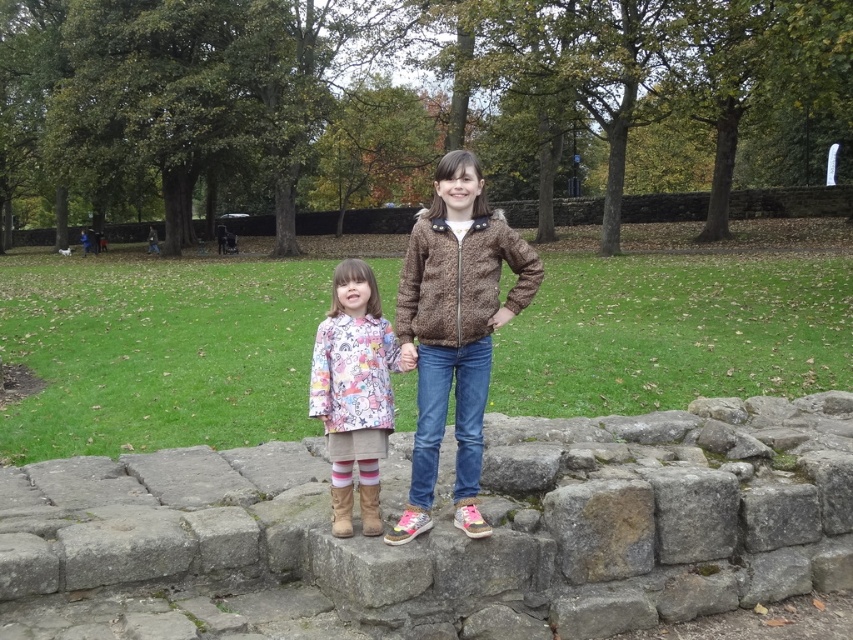
What do you see at coordinates (450, 531) in the screenshot? This screenshot has height=640, width=853. I see `brown stone at center` at bounding box center [450, 531].

Between point (193, 480) and point (428, 246), which one is positioned in front?

Point (428, 246) is more forward.

Does point (700, 560) come in front of point (482, 518)?

No, (700, 560) is behind (482, 518).

You are a GUI agent. You are given a task and a screenshot of the screen. Output one action in this format:
    pyautogui.click(x=<x>, y=<y>)
    Task: Click on the brown stone at center
    
    Given the screenshot: What is the action you would take?
    pyautogui.click(x=450, y=531)

Between brown textured jacket at center and printed fabric coat at center, which one appears on the left side from the viewer's perspective?

printed fabric coat at center is more to the left.

Does point (457, 234) lie in front of point (346, 420)?

No.

From the picture: Who is more forward, (485, 381) or (370, 413)?

Point (370, 413)

At what (x,y) coordinates should I click in order to perform the action: click on brown textured jacket at center. Please return your answer as a coordinate pair (x, y). This screenshot has width=853, height=640. Looking at the image, I should click on (454, 332).

Between brown stone at center and printed fabric coat at center, which one is positioned lower?

Positioned lower is brown stone at center.

Consider the image. Which of these two, brown stone at center or printed fabric coat at center, stands shorter?

brown stone at center

Is point (308, 538) positioned after point (376, 465)?

Yes, point (308, 538) is behind point (376, 465).

Locate an element on the screen. brown stone at center is located at coordinates (450, 531).